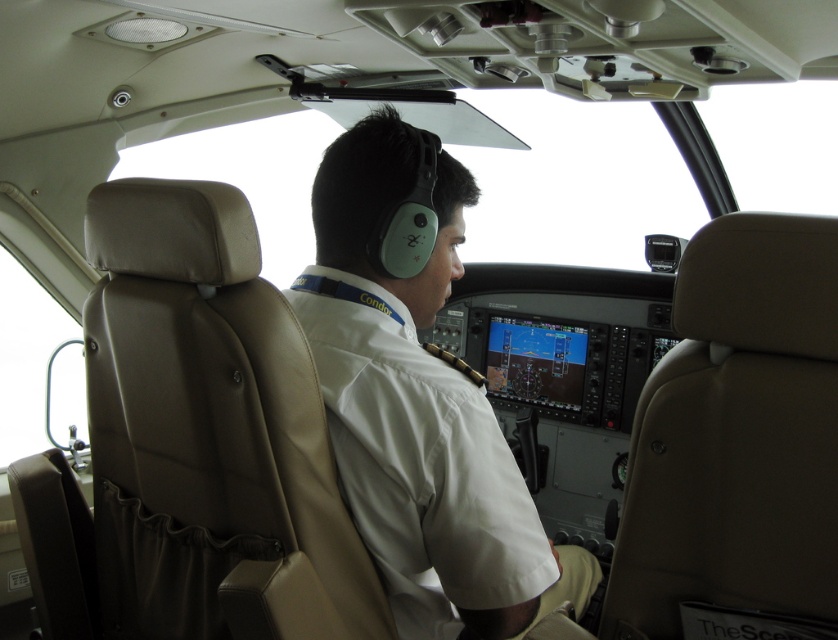
Which is above, leather seat at left or white fabric pilot at center?

white fabric pilot at center is higher up.

The width and height of the screenshot is (838, 640). What are the coordinates of `leather seat at left` in the screenshot? It's located at (210, 433).

Between point (210, 252) and point (529, 589), which one is positioned in front?

Point (210, 252) is more forward.

This screenshot has width=838, height=640. In order to click on leather seat at left in this screenshot , I will do `click(210, 433)`.